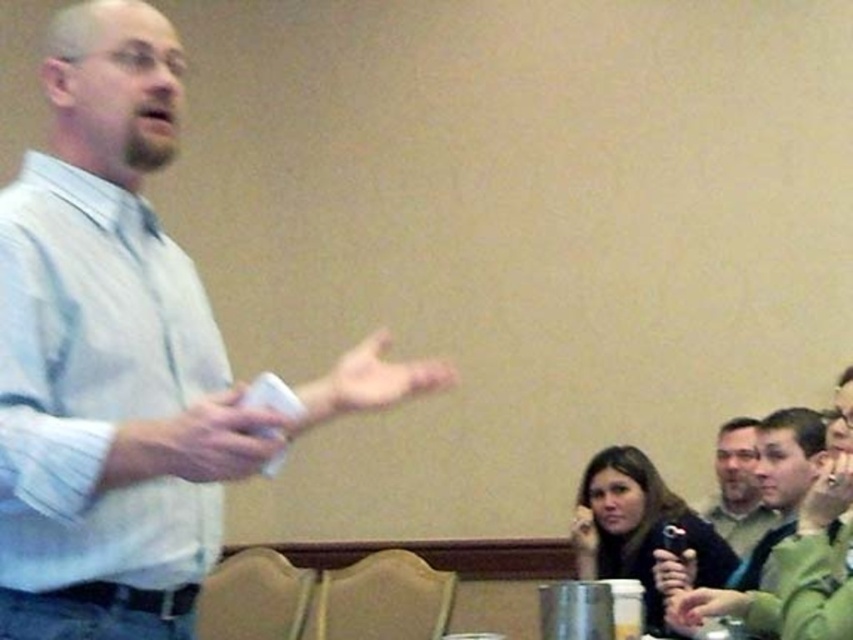
You are organizing a charity event and need to decide which of the two shirts, the white shirt at left or the green fabric shirt at center, to donate. Based on their sizes, which one would be more suitable for a larger person?

The white shirt at left is bigger than the green fabric shirt at center, so it would be more suitable for a larger person.

You are standing in a conference room and see the point at coordinates (x=321, y=400). If you want to toss a small ball to that point, will it land within 2 meters from you?

The distance between you and the point is 1.66 meters, so yes, the ball will land within 2 meters from you.

You are organizing a photo shoot and need to place two shirts on a display rack. The white shirt at left and the green fabric shirt at center must be arranged based on their sizes. Which shirt should you place on the left side of the rack to ensure proper size order from largest to smallest?

The white shirt at left should be placed on the left side of the rack since it is wider than the green fabric shirt at center, ensuring the proper size order from largest to smallest.